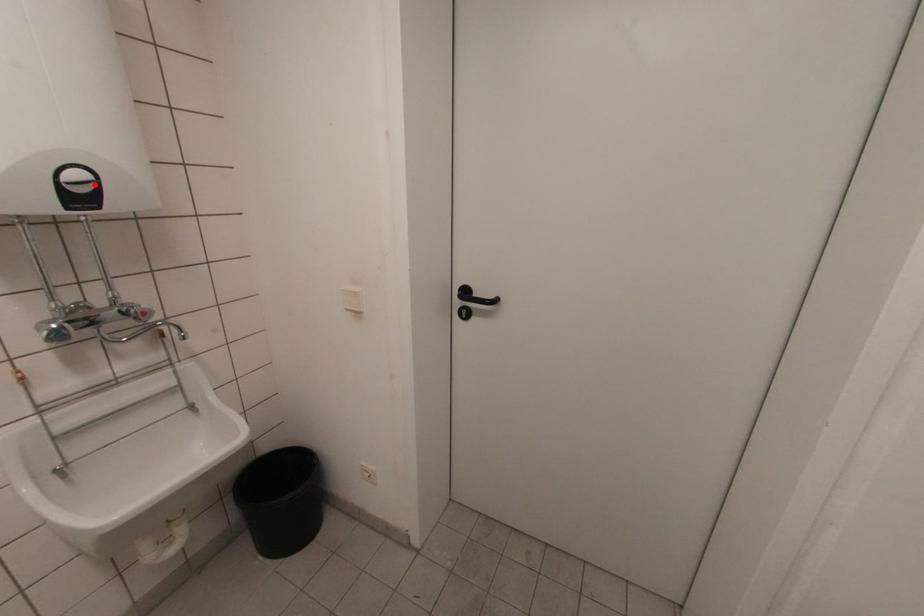
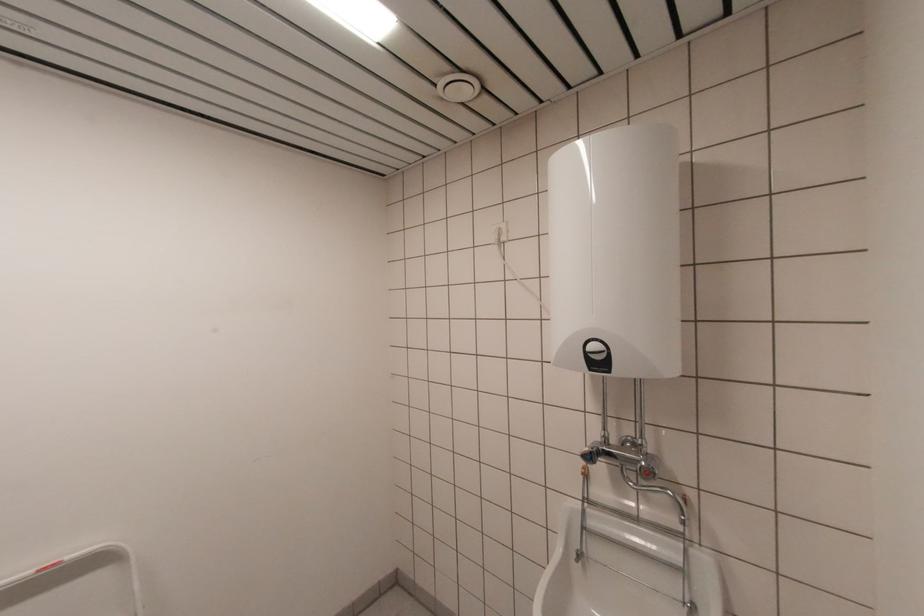
Locate, in the second image, the point that corresponds to the highlighted location in the first image.

(605, 354)